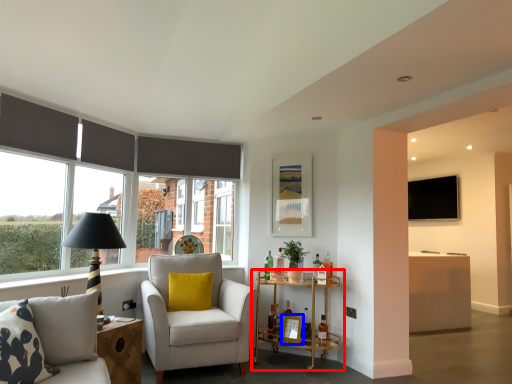
Question: Which point is further to the camera, table (highlighted by a red box) or picture frame (highlighted by a blue box)?

Choices:
 (A) table
 (B) picture frame

Answer: (B)